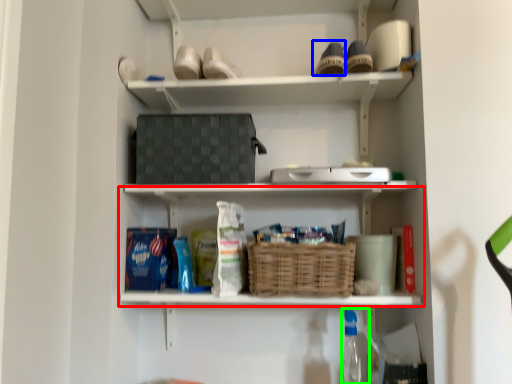
Question: Based on their relative distances, which object is farther from shelf (highlighted by a red box)? Choose from shoe (highlighted by a blue box) and bottle (highlighted by a green box).

Choices:
 (A) shoe
 (B) bottle

Answer: (A)